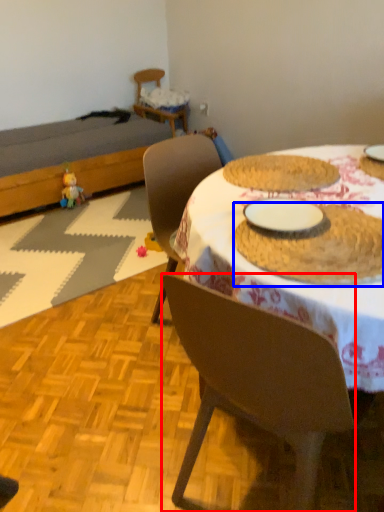
Question: Which object appears closest to the camera in this image, chair (highlighted by a red box) or food (highlighted by a blue box)?

Choices:
 (A) chair
 (B) food

Answer: (A)